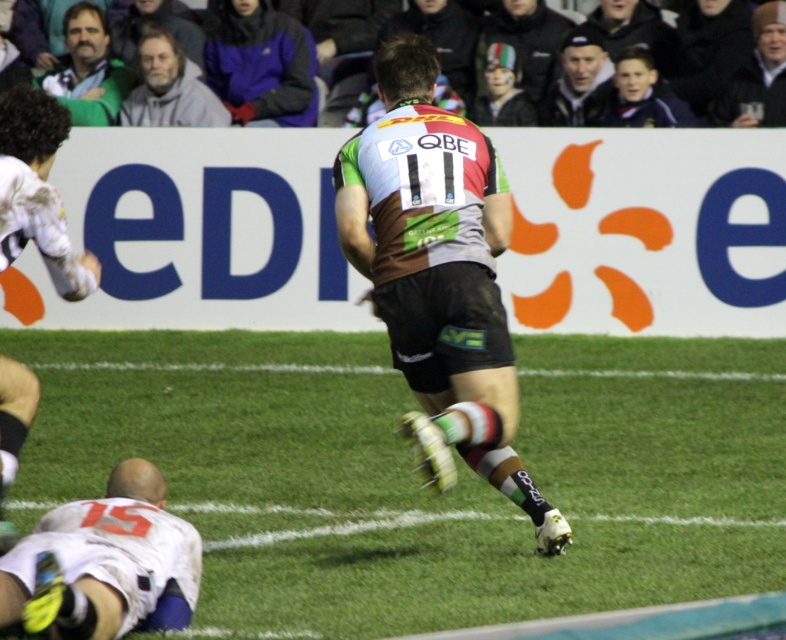
You are a photographer standing next to the camera. You want to take a picture of the gray woolen sweater at upper left. Is the sweater within your camera lens range? The camera can capture objects up to 50 feet away.

The gray woolen sweater at upper left and camera are 48.96 feet apart from each other. Since the camera can capture objects up to 50 feet away, the sweater is within range and can be photographed.

You are a photographer trying to capture the rugby match. You notice the gray woolen sweater at upper left and the black leather jacket at upper right in your camera viewfinder. Based on their positions, which object is closer to the bottom edge of the frame?

The gray woolen sweater at upper left is closer to the bottom edge of the frame because it is positioned below the black leather jacket at upper right.

You are a sports equipment manager who needs to store the gray woolen sweater at upper left and the black leather jacket at upper right in a narrow locker. Which item should you place first to ensure both fit?

The black leather jacket at upper right is narrower than the gray woolen sweater at upper left. Place the narrower black leather jacket at upper right first to allow more space for the wider gray woolen sweater at upper left.